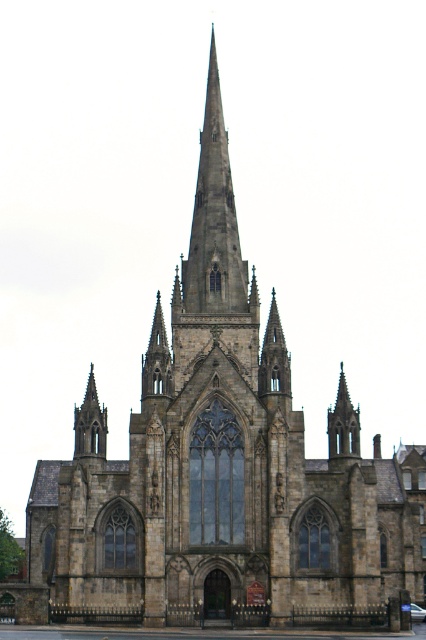
Question: Which is nearer to the dark brown stone spire at center?

Choices:
 (A) brown stone spire at lower left
 (B) dark gray stone spire at center
 (C) dark brown stone spire at upper center

Answer: (C)

Question: Which point is closer to the camera taking this photo?

Choices:
 (A) (158, 336)
 (B) (273, 385)
 (C) (342, 397)

Answer: (B)

Question: Among these objects, which one is nearest to the camera?

Choices:
 (A) brown stone spire at lower left
 (B) dark gray stone spire at center

Answer: (A)

Question: Does dark brown stone spire at center appear over dark brown stone spire at upper center?

Choices:
 (A) no
 (B) yes

Answer: (B)

Question: Where is dark brown stone spire at center located in relation to brown stone spire at lower left in the image?

Choices:
 (A) below
 (B) above

Answer: (B)

Question: Is dark gray stone spire at center to the right of brown stone spire at lower left from the viewer's perspective?

Choices:
 (A) yes
 (B) no

Answer: (A)